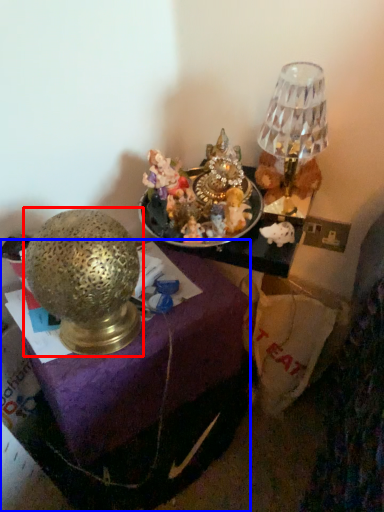
Question: Among these objects, which one is nearest to the camera, lamp (highlighted by a red box) or furniture (highlighted by a blue box)?

Choices:
 (A) lamp
 (B) furniture

Answer: (A)